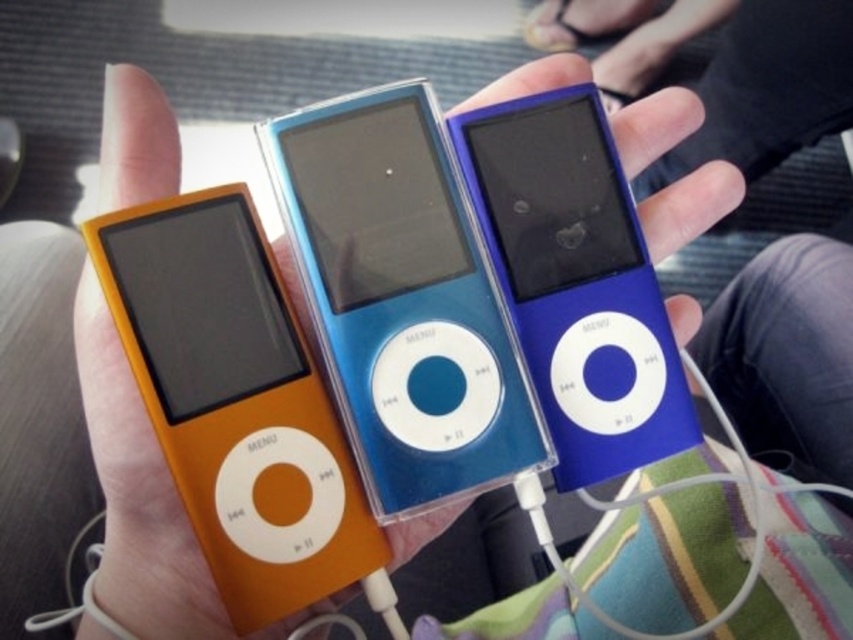
You are holding three iPod Nanos in your hand. You need to place them on a shelf that can only accommodate two iPods side by side without overlapping. The shelf is exactly 5 inches wide. The orange matte ipod at left and orange glossy ipod at center are two of the iPods. Can both of these iPods fit side by side on the shelf without overlapping?

The orange matte ipod at left is 2.62 inches from the orange glossy ipod at center, which means the total width required for both would be more than 5 inches. Therefore, they cannot fit side by side on the shelf without overlapping.

You are holding three iPod Nano devices in your hand. You notice a point at coordinates (664, 214). Based on the scene, can you determine if this point is closer to you or farther away compared to the iPods?

The point at coordinates (664, 214) is 19.77 inches from the viewer, so it is closer to you than the iPods.

You are holding three iPod Nanos in your hand. You notice an orange glossy ipod at center and a blue glossy ipod at center. Which one is positioned more to the left?

The orange glossy ipod at center is positioned more to the left than the blue glossy ipod at center.